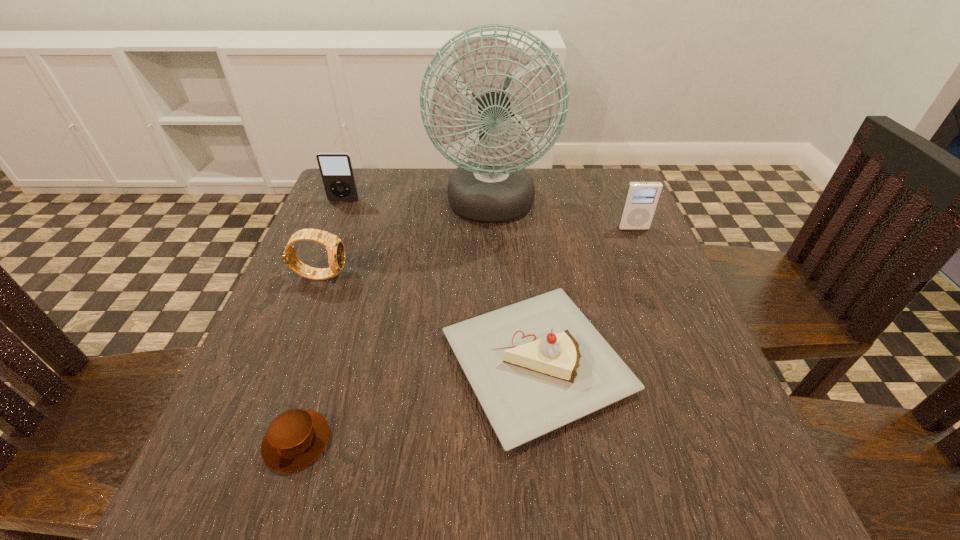
Find the location of `fan`. fan is located at coordinates (495, 187).

The image size is (960, 540). I want to click on the left iPod, so click(x=336, y=169).

Find the location of `the rightmost object`. the rightmost object is located at coordinates (641, 199).

You are a GUI agent. You are given a task and a screenshot of the screen. Output one action in this format:
    pyautogui.click(x=<x>, y=<y>)
    Task: Click on the nearer iPod
    This screenshot has width=960, height=540.
    Given the screenshot: What is the action you would take?
    pyautogui.click(x=641, y=199)

The image size is (960, 540). What are the coordinates of `the fourth farthest object` in the screenshot? It's located at [x=335, y=248].

Where is `the second shortest object`? The image size is (960, 540). the second shortest object is located at coordinates (537, 365).

The height and width of the screenshot is (540, 960). In order to click on muffin in this screenshot , I will do `click(296, 438)`.

Locate an element on the screen. Image resolution: width=960 pixels, height=540 pixels. free space located in front of the fan where the airflow is directed is located at coordinates (497, 386).

Identify the location of free space located 0.140m on the front-facing side of the left iPod. (329, 236).

Identify the location of vacant area situated 0.050m on the front-facing side of the right iPod. [640, 244].